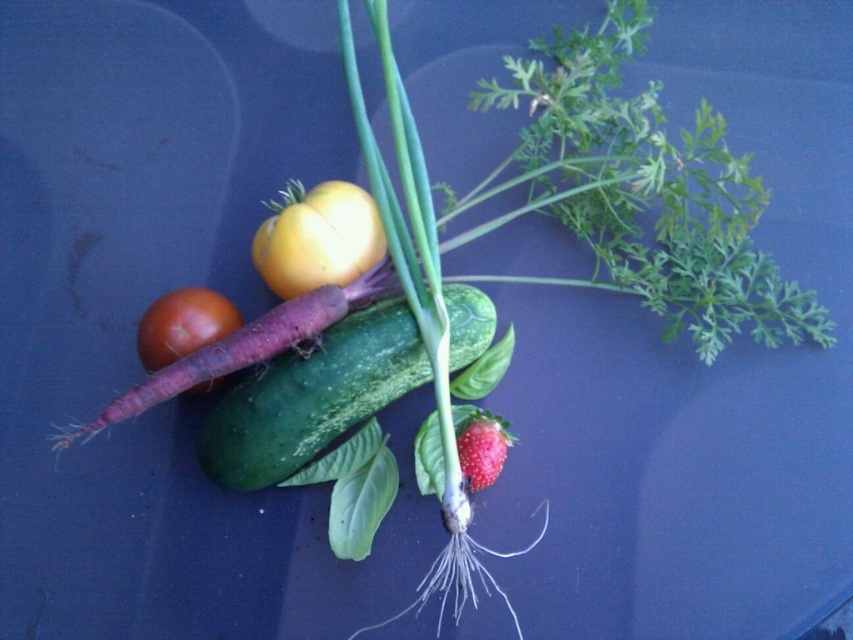
Question: Estimate the real-world distances between objects in this image. Which object is closer to the shiny red strawberry at center?

Choices:
 (A) matte red tomato at center-left
 (B) green matte cucumber at center
 (C) yellow matte tomato at center

Answer: (B)

Question: Is matte red tomato at center-left wider than shiny red strawberry at center?

Choices:
 (A) yes
 (B) no

Answer: (A)

Question: Can you confirm if matte red tomato at center-left is positioned to the right of shiny red strawberry at center?

Choices:
 (A) yes
 (B) no

Answer: (B)

Question: From the image, what is the correct spatial relationship of green matte cucumber at center in relation to shiny red strawberry at center?

Choices:
 (A) above
 (B) below

Answer: (A)

Question: Which object is positioned closest to the shiny red strawberry at center?

Choices:
 (A) matte red tomato at center-left
 (B) green matte cucumber at center

Answer: (B)

Question: Which is farther from the matte red tomato at center-left?

Choices:
 (A) yellow matte tomato at center
 (B) shiny red strawberry at center

Answer: (B)